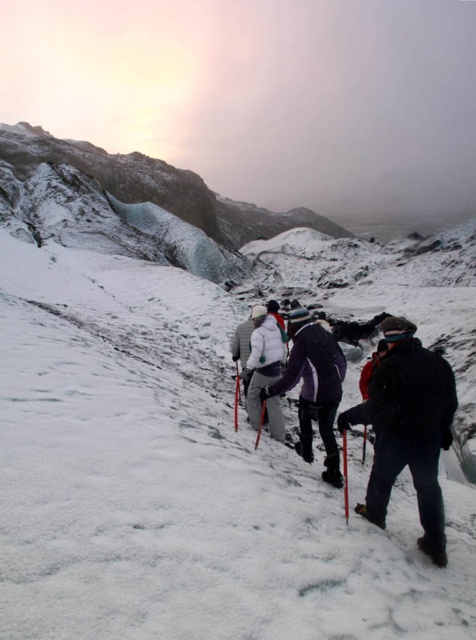
Based on the photo, can you confirm if dark blue jacket at lower right is positioned to the right of black matte ski at lower right?

Incorrect, dark blue jacket at lower right is not on the right side of black matte ski at lower right.

Can you confirm if dark blue jacket at lower right is positioned below black matte ski at lower right?

Incorrect, dark blue jacket at lower right is not positioned below black matte ski at lower right.

Is point (388, 349) more distant than point (444, 563)?

Yes, it is.

Where is `dark blue jacket at lower right`? The image size is (476, 640). dark blue jacket at lower right is located at coordinates (407, 429).